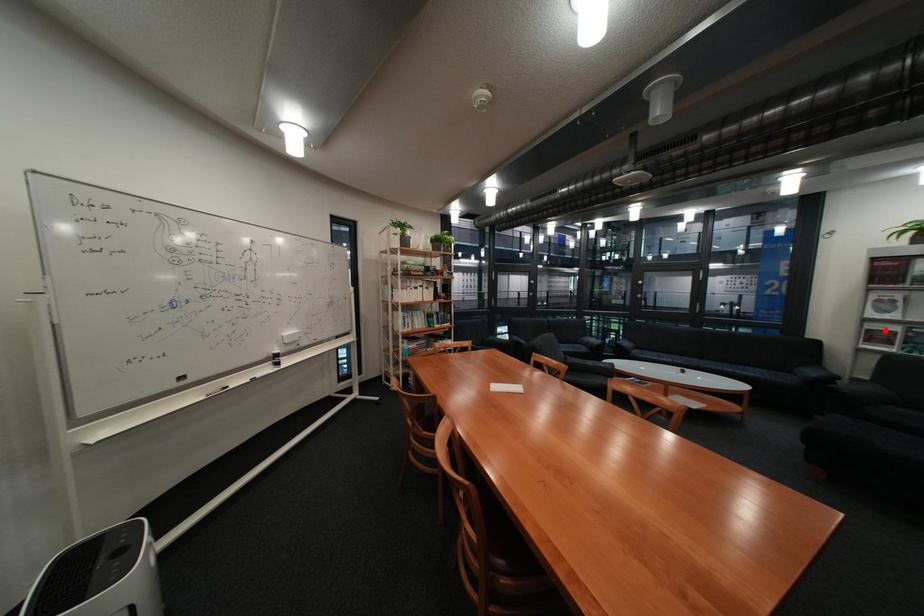
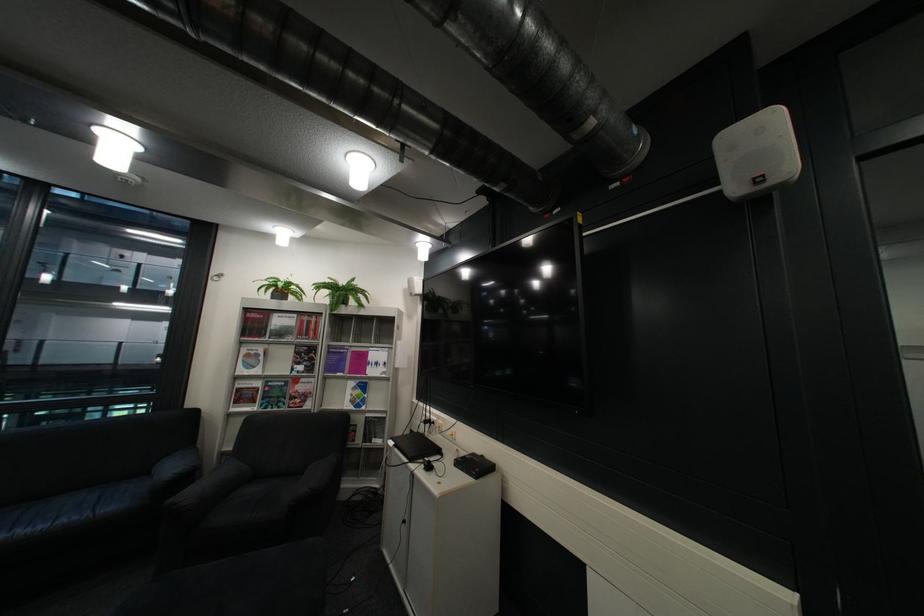
Where in the second image is the point corresponding to the highlighted location from the first image?

(254, 390)